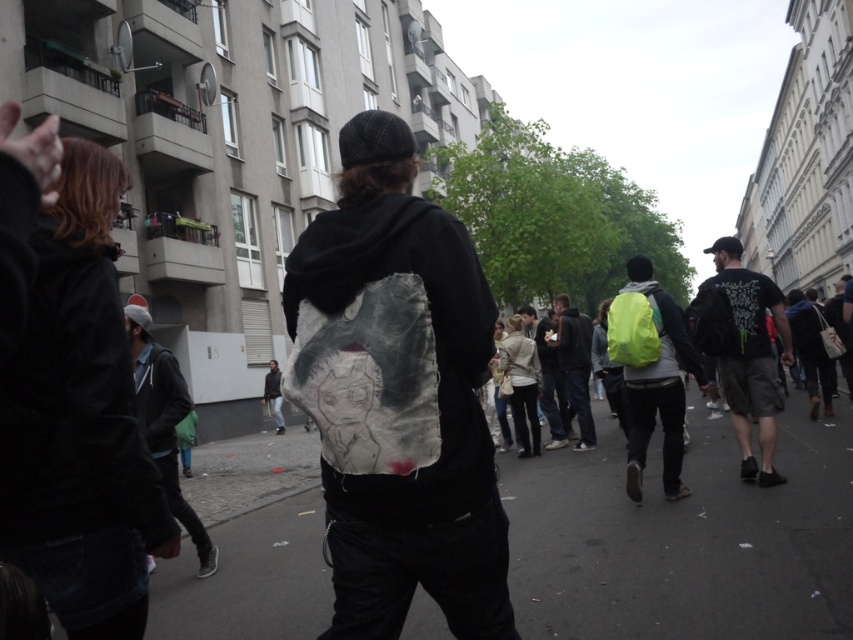
You are a delivery person who needs to choose between placing a small package in either the matte canvas bag at center or the neon green backpack at center. Based on their sizes, which one do you think can hold the package better?

The neon green backpack at center can hold the package better because it occupies more space than the matte canvas bag at center.